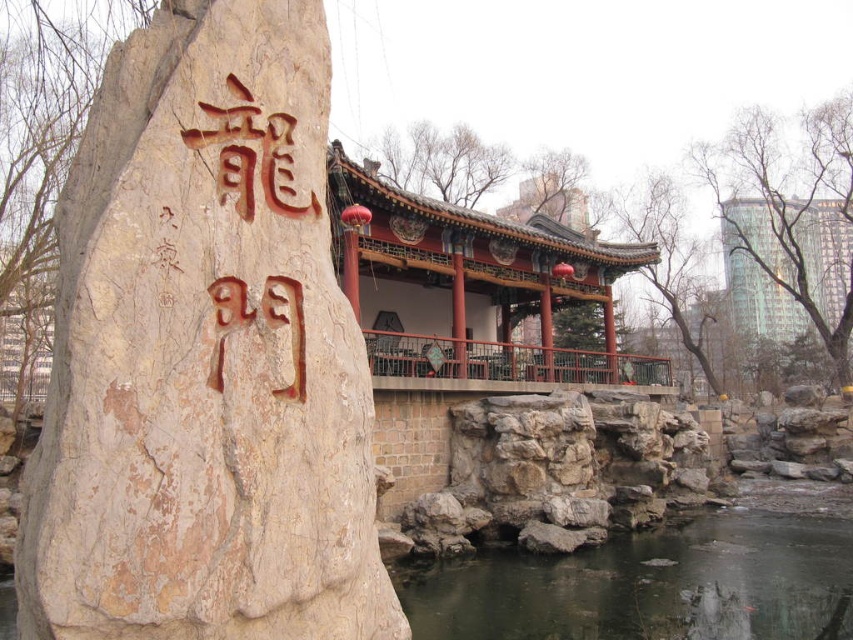
You are standing in the traditional Chinese garden scene described. You notice two points marked in the image. The first point is at coordinate point(x=231, y=602) and the second is at point(x=787, y=637). Which of these two points is nearer to you?

Point(x=231, y=602) is closer to the viewer than point(x=787, y=637).

You are a visitor in this traditional Chinese garden. You see the clear water at lower center and the brown carved stone at left. Which object is positioned lower in the scene?

The clear water at lower center is positioned lower than the brown carved stone at left in the scene.

You are a tourist visiting this traditional Chinese garden. You want to take a photo of the beige stone boulder at center and the clear water at lower center together in the same frame. Your camera has a maximum focus range of 8 meters. Will you be able to capture both objects in one shot?

The beige stone boulder at center is 7.98 meters away from the clear water at lower center. Since the distance between them is within the camera maximum focus range of 8 meters, you can capture both objects in one shot.